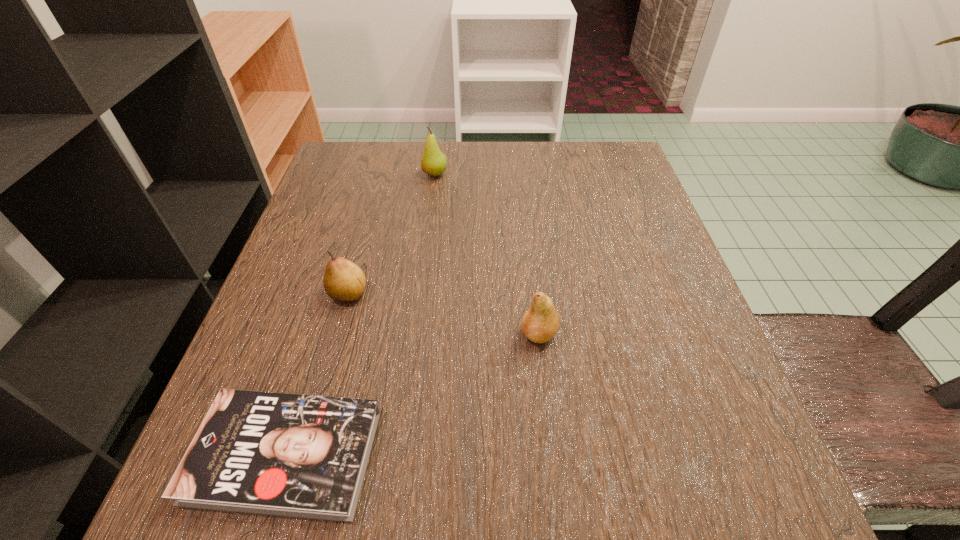
Find the location of a particular element. free spot between the book and the rightmost pear is located at coordinates (412, 394).

This screenshot has height=540, width=960. What are the coordinates of `vacant area that lies between the farthest object and the book` in the screenshot? It's located at (360, 315).

Locate which object is the closest to the second object from right to left. Please provide its 2D coordinates. Your answer should be formatted as a tuple, i.e. [(x, y)], where the tuple contains the x and y coordinates of a point satisfying the conditions above.

[(344, 281)]

This screenshot has height=540, width=960. I want to click on the second closest object to the third nearest object, so point(540,322).

This screenshot has height=540, width=960. Find the location of `the closest pear to the shortest object`. the closest pear to the shortest object is located at coordinates [x=344, y=281].

Locate an element on the screen. This screenshot has width=960, height=540. pear that is the second closest to the third object from left to right is located at coordinates (540, 322).

Find the location of a particular element. The width and height of the screenshot is (960, 540). vacant space that satisfies the following two spatial constraints: 1. on the back side of the farthest pear; 2. on the left side of the leftmost pear is located at coordinates (382, 174).

Locate an element on the screen. The image size is (960, 540). vacant area in the image that satisfies the following two spatial constraints: 1. on the front side of the second nearest object; 2. on the right side of the shortest pear is located at coordinates tap(337, 334).

Image resolution: width=960 pixels, height=540 pixels. I want to click on free space that satisfies the following two spatial constraints: 1. on the back side of the nearest object; 2. on the right side of the farthest object, so point(372,174).